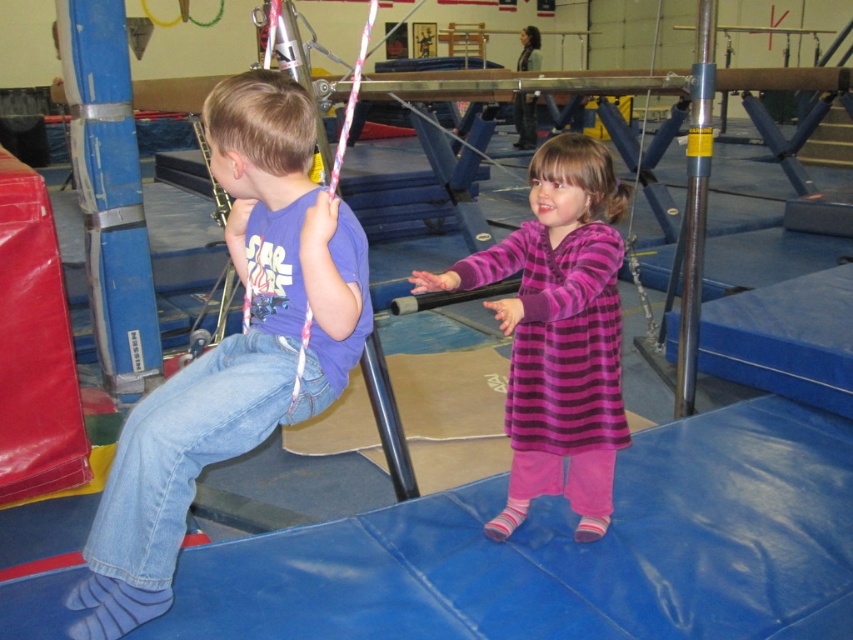
Who is positioned more to the right, matte purple shirt at left or blue rubber pole at left?

matte purple shirt at left is more to the right.

Which is below, matte purple shirt at left or blue rubber pole at left?

Positioned lower is matte purple shirt at left.

Does point (180, 492) come behind point (131, 376)?

No.

At what (x,y) coordinates should I click in order to perform the action: click on matte purple shirt at left. Please return your answer as a coordinate pair (x, y). The width and height of the screenshot is (853, 640). Looking at the image, I should click on (231, 349).

Which is below, purple striped dress at center or yellow rubber pole at center right?

Positioned lower is purple striped dress at center.

Between point (560, 172) and point (689, 365), which one is positioned behind?

The point (689, 365) is behind.

Based on the photo, who is more distant from viewer, (x=579, y=342) or (x=698, y=294)?

Point (x=698, y=294)

Find the location of a particular element. The image size is (853, 640). purple striped dress at center is located at coordinates (558, 333).

Which of these two, purple striped dress at center or blue rubber pole at left, stands taller?

With more height is blue rubber pole at left.

The image size is (853, 640). In order to click on purple striped dress at center in this screenshot , I will do `click(558, 333)`.

Identify the location of purple striped dress at center. (558, 333).